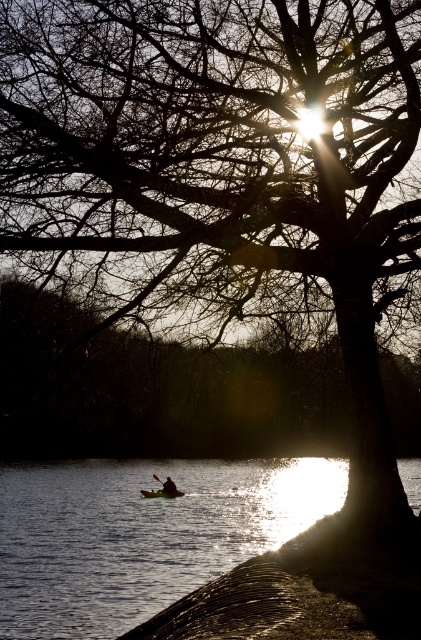
You are a photographer trying to capture the kayaker and the paddle. You notice the silvery reflective water at lower left and the black rubber paddle at center. Which object is wider in the image?

The silvery reflective water at lower left is wider than the black rubber paddle at center.

You are a photographer trying to capture the reflection of the dark brown leather kayak at center in the silvery reflective water at lower left. Based on their positions, do you think the reflection will be visible in the water?

The silvery reflective water at lower left is closer to the viewer than the dark brown leather kayak at center. Since the kayak is further away, its reflection might not be clearly visible in the water closer to the viewer unless the water surface is perfectly still and the angle allows for such a reflection.

You are a photographer trying to capture the kayak and the water in the image. Which object, the silvery reflective water at lower left or the dark brown leather kayak at center, appears taller in the photo?

The silvery reflective water at lower left appears taller than the dark brown leather kayak at center in the photo.